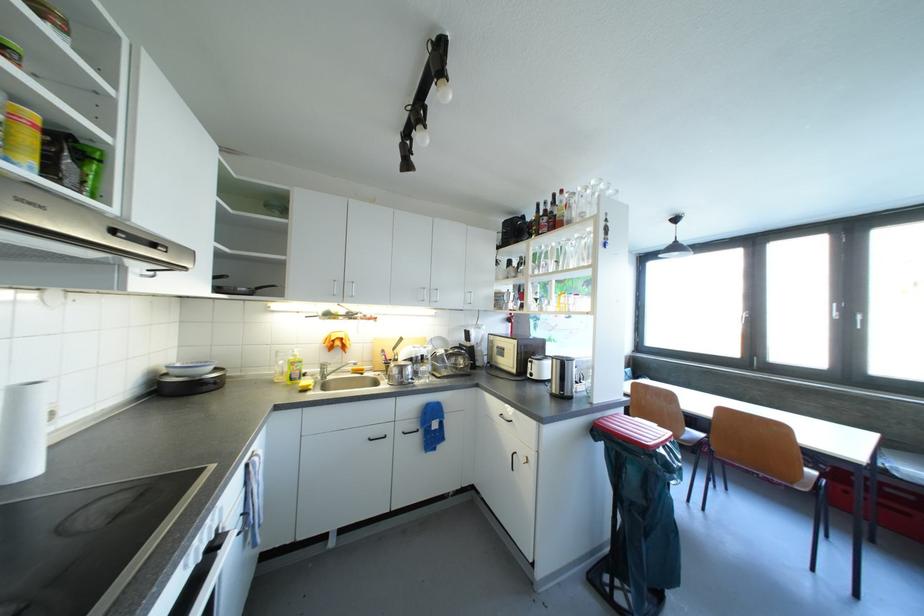
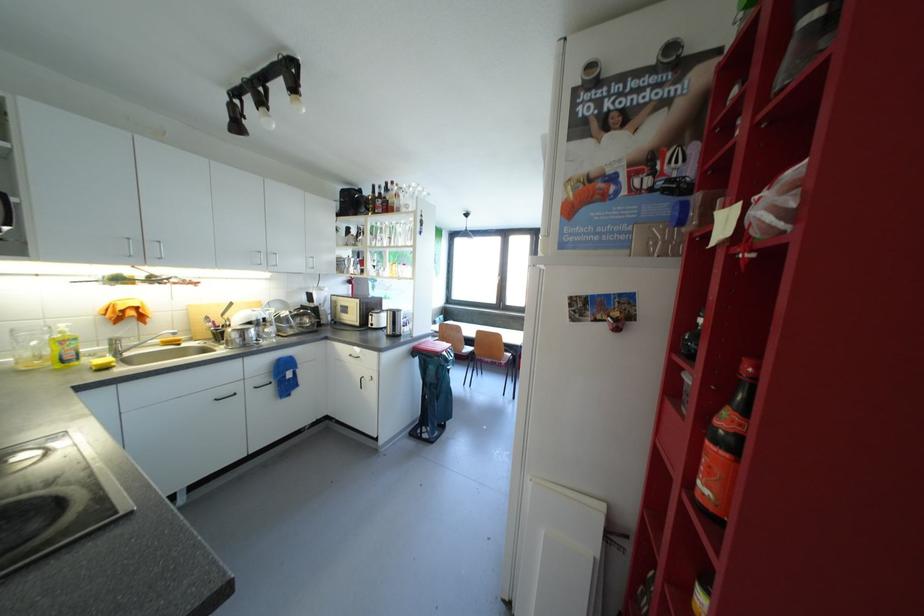
Question: The camera is either moving clockwise (left) or counter-clockwise (right) around the object. The first image is from the beginning of the video and the second image is from the end. Is the camera moving left or right when shooting the video?

Choices:
 (A) Left
 (B) Right

Answer: (A)